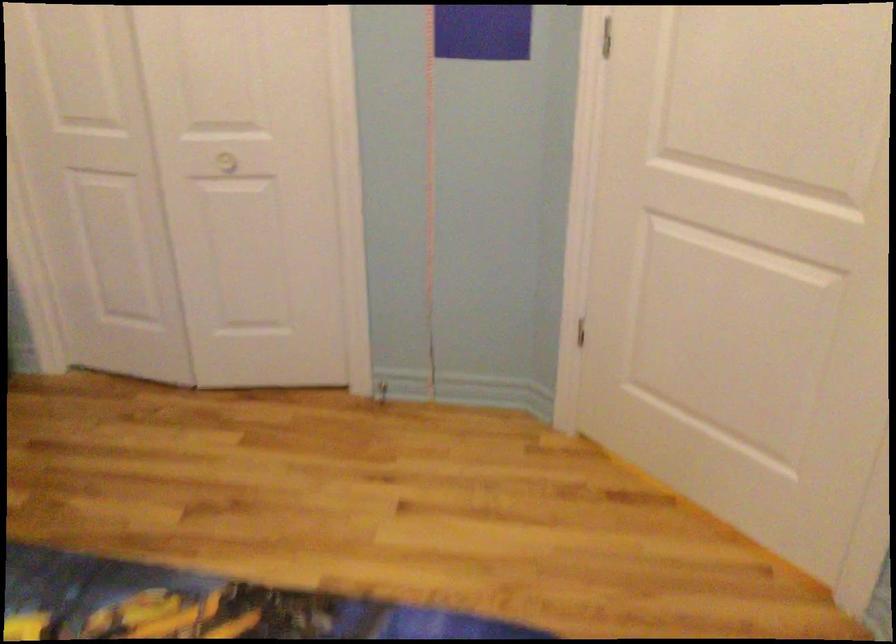
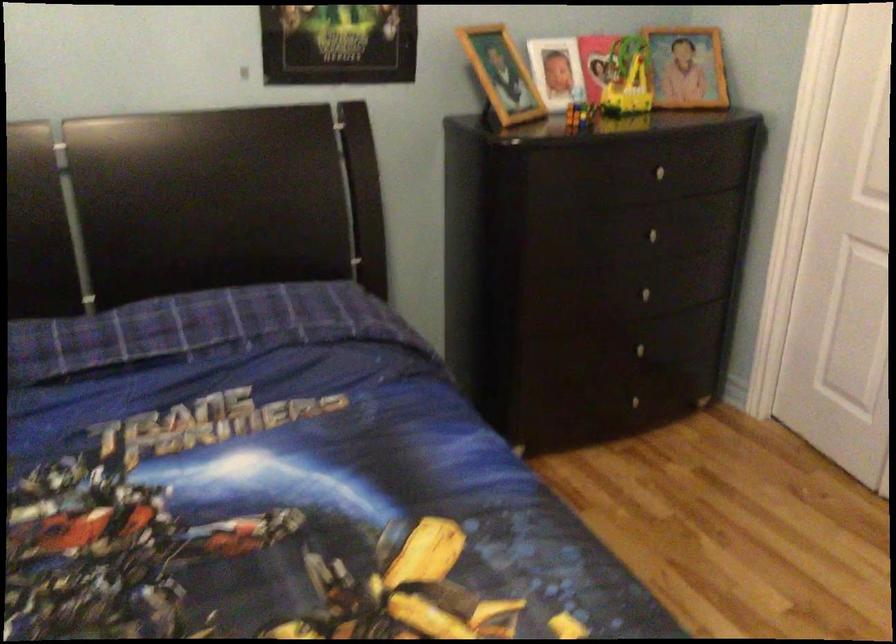
Question: The camera is either moving clockwise (left) or counter-clockwise (right) around the object. The first image is from the beginning of the video and the second image is from the end. Is the camera moving left or right when shooting the video?

Choices:
 (A) Left
 (B) Right

Answer: (B)